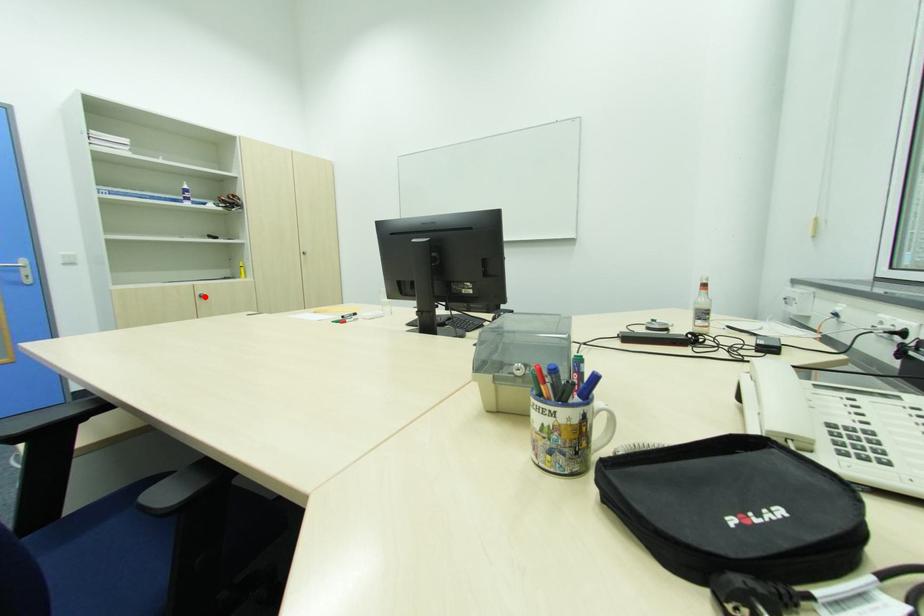
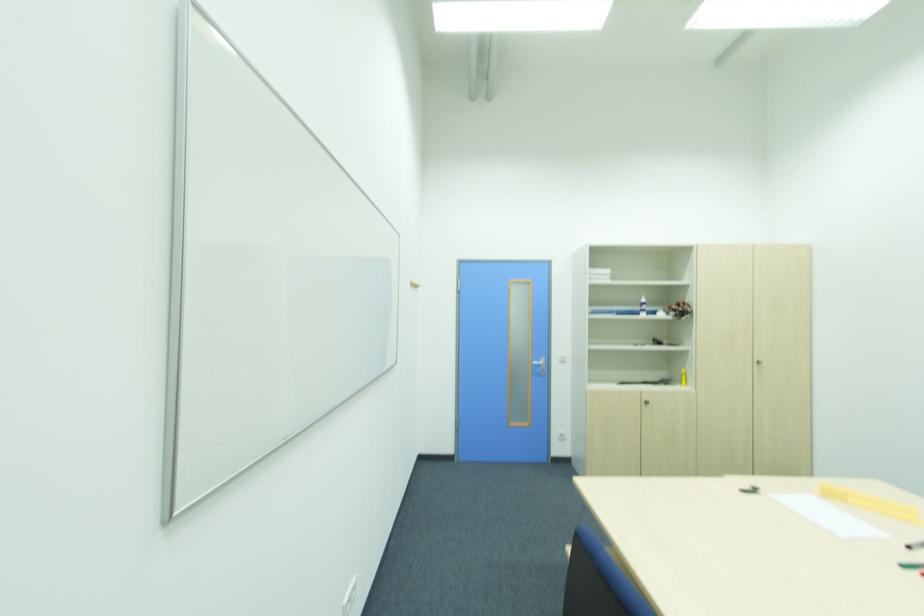
The point at the highlighted location is marked in the first image. Where is the corresponding point in the second image?

(650, 402)